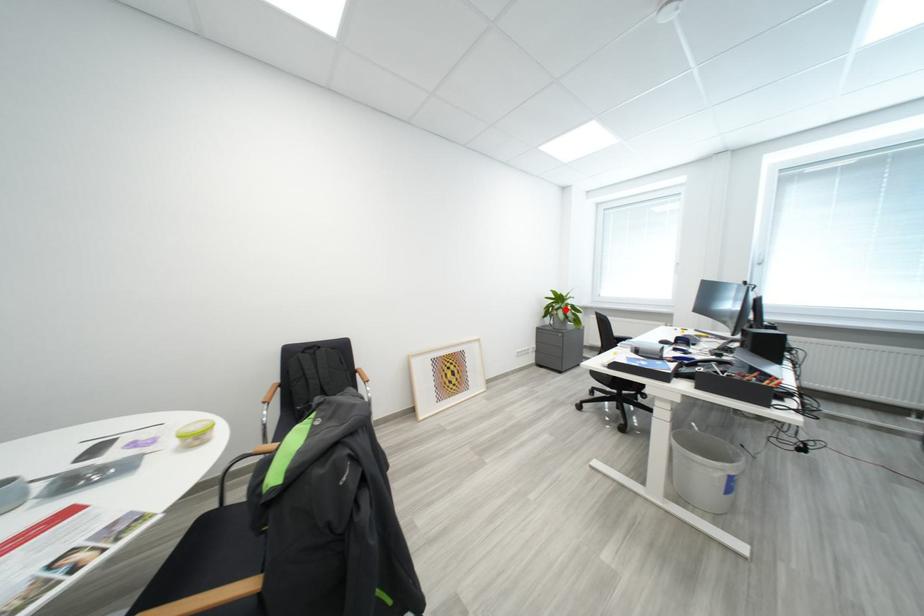
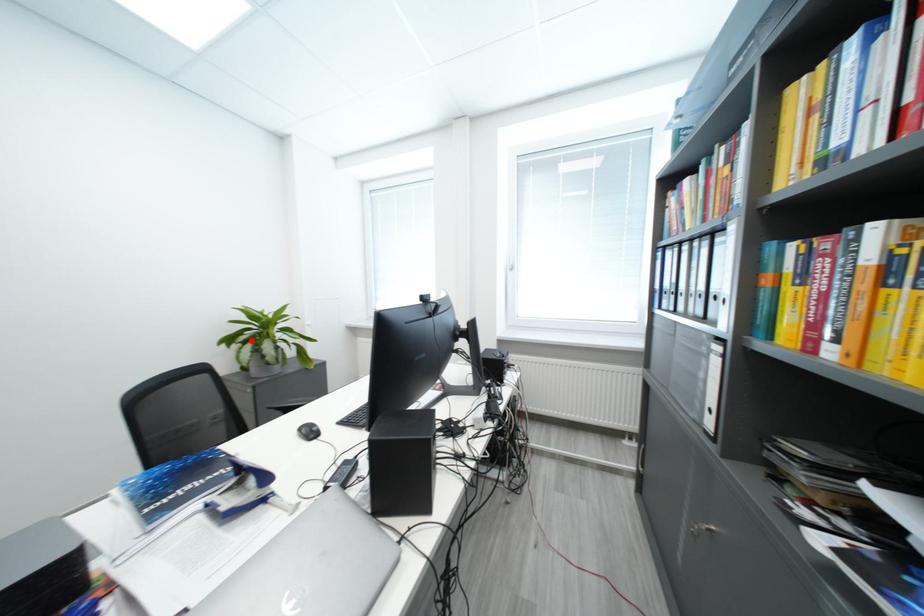
I am providing you with two images of the same scene from different viewpoints. A red point is marked on the first image and another point is marked on the second image. Is the red point in image1 aligned with the point shown in image2?

Yes